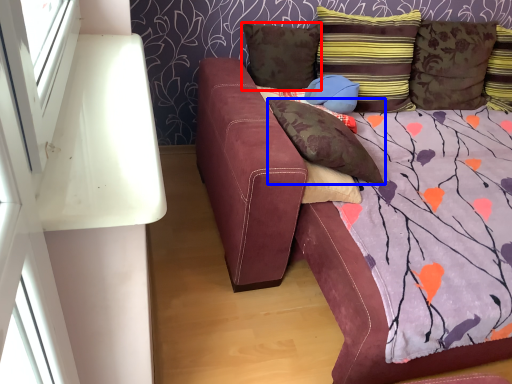
Question: Among these objects, which one is nearest to the camera, pillow (highlighted by a red box) or pillow (highlighted by a blue box)?

Choices:
 (A) pillow
 (B) pillow

Answer: (B)